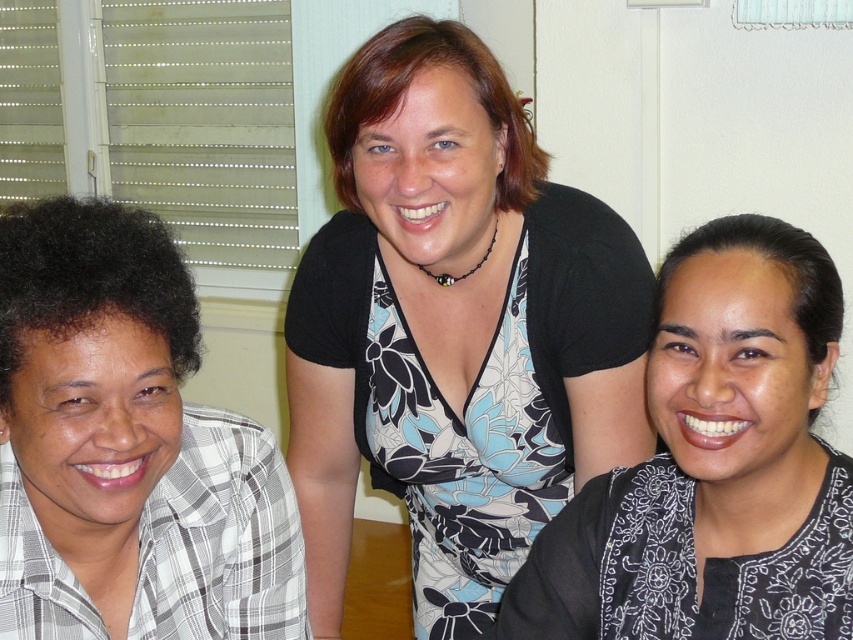
You are standing in the room and want to hand a gift to the person wearing the floral dress at center without touching the white checkered shirt at left. Is this possible based on their positions?

The floral dress at center is positioned over the white checkered shirt at left, so it is possible to hand the gift to the floral dress at center without touching the white checkered shirt at left by reaching above the shirt.

You are trying to decide which clothing item to choose for a casual day out. Based on the image, which clothing item is narrower between the white checkered shirt at left and the black floral dress at center?

The white checkered shirt at left is narrower than the black floral dress at center according to the description.